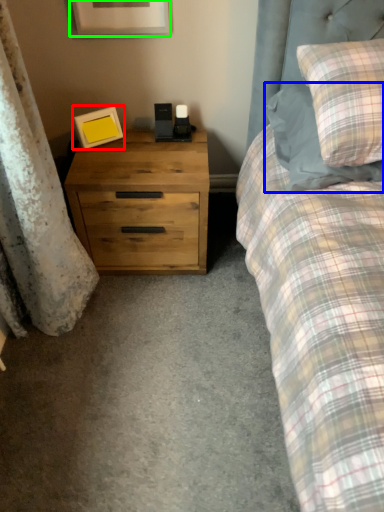
Question: Which is farther away from picture frame (highlighted by a red box)? pillow (highlighted by a blue box) or picture frame (highlighted by a green box)?

Choices:
 (A) pillow
 (B) picture frame

Answer: (A)